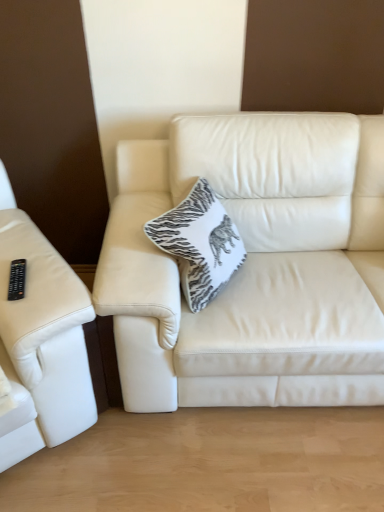
Question: From a real-world perspective, relative to leather couch at left, arranged as the first studio couch when viewed from the left, is white textured cushion at center vertically above or below?

Choices:
 (A) above
 (B) below

Answer: (A)

Question: In terms of width, does white textured cushion at center look wider or thinner when compared to leather couch at left, which is the second studio couch from right to left?

Choices:
 (A) thin
 (B) wide

Answer: (A)

Question: Which is nearer to the white leather couch at center, the second studio couch when ordered from left to right?

Choices:
 (A) white textured cushion at center
 (B) leather couch at left, which is the second studio couch from right to left
 (C) black plastic remote at left

Answer: (A)

Question: Estimate the real-world distances between objects in this image. Which object is closer to the white leather couch at center, the 1th studio couch from the right?

Choices:
 (A) black plastic remote at left
 (B) leather couch at left, which is the second studio couch from right to left
 (C) white textured cushion at center

Answer: (C)